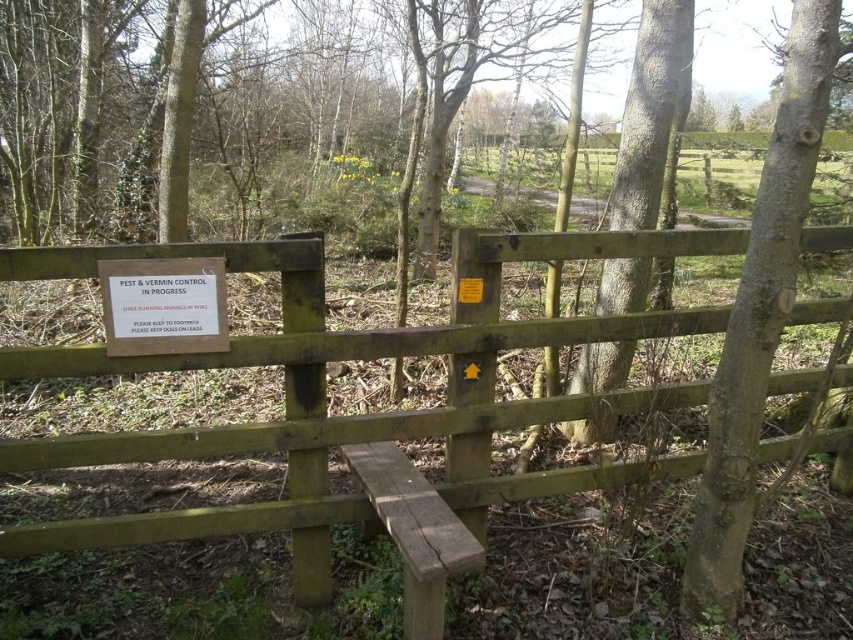
Between rough bark tree at center and white paper sign at center, which one is positioned higher?

white paper sign at center

Which of these two, rough bark tree at center or white paper sign at center, stands taller?

With more height is rough bark tree at center.

Image resolution: width=853 pixels, height=640 pixels. I want to click on rough bark tree at center, so click(759, 312).

I want to click on rough bark tree at center, so 759,312.

Who is shorter, rough bark tree at center or brown rough wood at center?

brown rough wood at center

Does rough bark tree at center have a larger size compared to brown rough wood at center?

Yes, rough bark tree at center is bigger than brown rough wood at center.

Image resolution: width=853 pixels, height=640 pixels. Identify the location of rough bark tree at center. (759, 312).

Image resolution: width=853 pixels, height=640 pixels. In order to click on rough bark tree at center in this screenshot , I will do `click(759, 312)`.

Between green wooden fence at center and white paper sign at center, which one has less height?

white paper sign at center

This screenshot has width=853, height=640. Describe the element at coordinates (363, 413) in the screenshot. I see `green wooden fence at center` at that location.

Image resolution: width=853 pixels, height=640 pixels. Describe the element at coordinates (363, 413) in the screenshot. I see `green wooden fence at center` at that location.

Where is `green wooden fence at center`? green wooden fence at center is located at coordinates (363, 413).